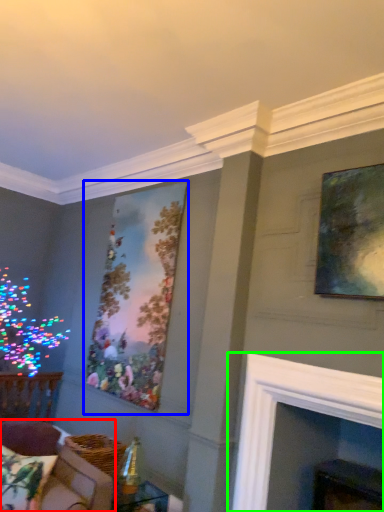
Question: Considering the real-world distances, which object is farthest from couch (highlighted by a red box)? picture frame (highlighted by a blue box) or fireplace (highlighted by a green box)?

Choices:
 (A) picture frame
 (B) fireplace

Answer: (A)